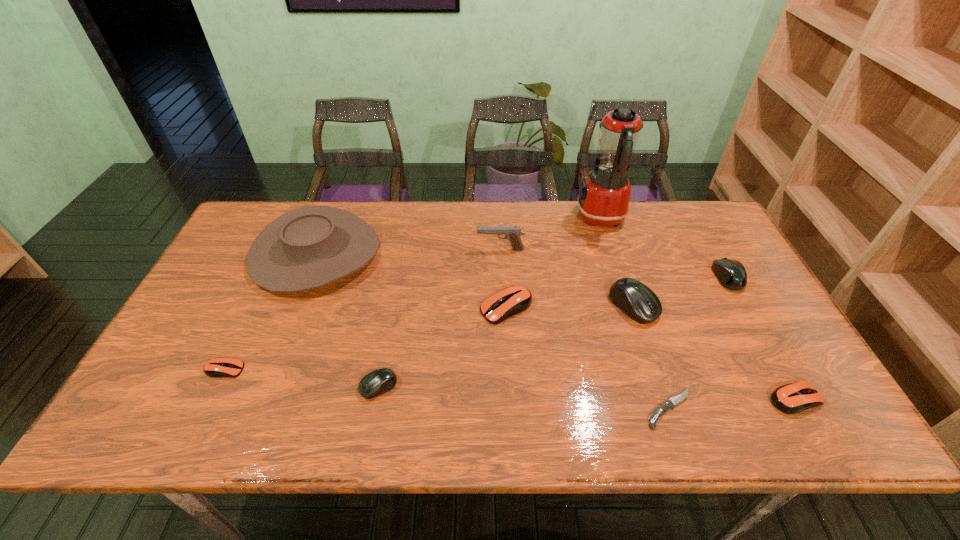
You are a GUI agent. You are given a task and a screenshot of the screen. Output one action in this format:
    pyautogui.click(x=<x>, y=<y>)
    Task: Click on the blank area in the image that satisfies the following two spatial constraints: 1. at the barrel of the pocketknife; 2. on the right side of the pistol
    
    Given the screenshot: What is the action you would take?
    pyautogui.click(x=509, y=409)

Locate an element on the screen. Image resolution: width=960 pixels, height=540 pixels. vacant region that satisfies the following two spatial constraints: 1. at the barrel of the biggest orange computer mouse; 2. on the left side of the pistol is located at coordinates (503, 308).

Locate an element on the screen. Image resolution: width=960 pixels, height=540 pixels. vacant area that satisfies the following two spatial constraints: 1. on the front side of the second smallest orange computer mouse; 2. on the left side of the smallest black mouse is located at coordinates (376, 399).

Locate an element on the screen. The width and height of the screenshot is (960, 540). free space in the image that satisfies the following two spatial constraints: 1. on the controls of the tallest object; 2. on the back side of the rightmost orange computer mouse is located at coordinates (658, 399).

Identify the location of free location that satisfies the following two spatial constraints: 1. on the front side of the third shortest object; 2. on the left side of the cowboy hat. This screenshot has height=540, width=960. tap(258, 399).